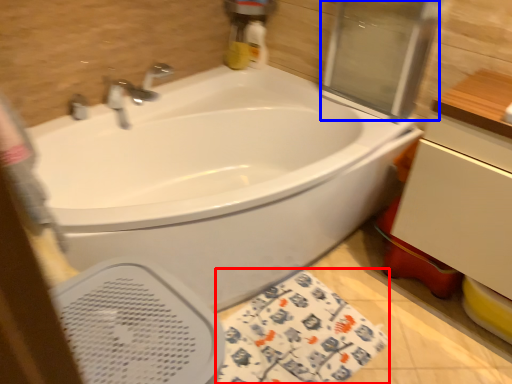
Question: Which point is further to the camera, beach towel (highlighted by a red box) or screen door (highlighted by a blue box)?

Choices:
 (A) beach towel
 (B) screen door

Answer: (B)